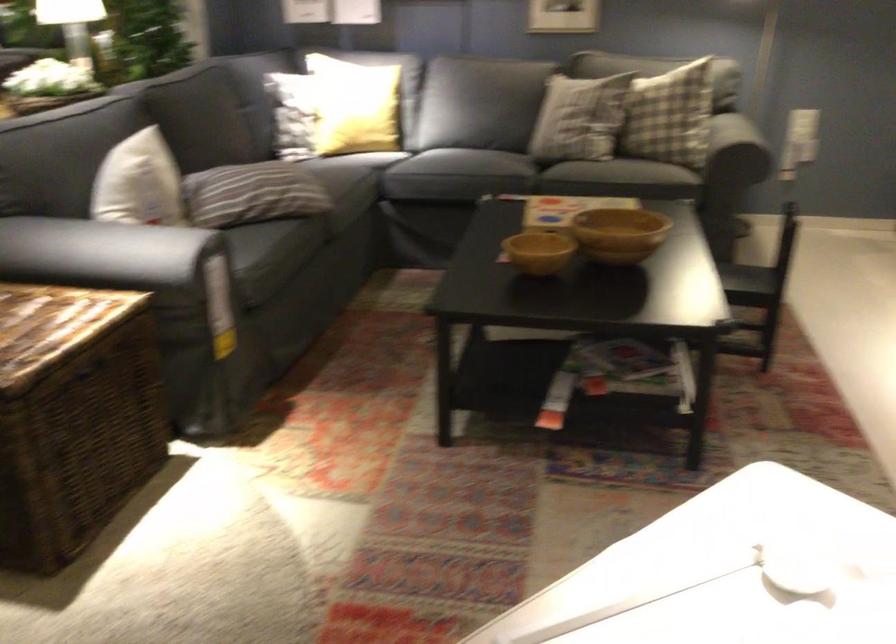
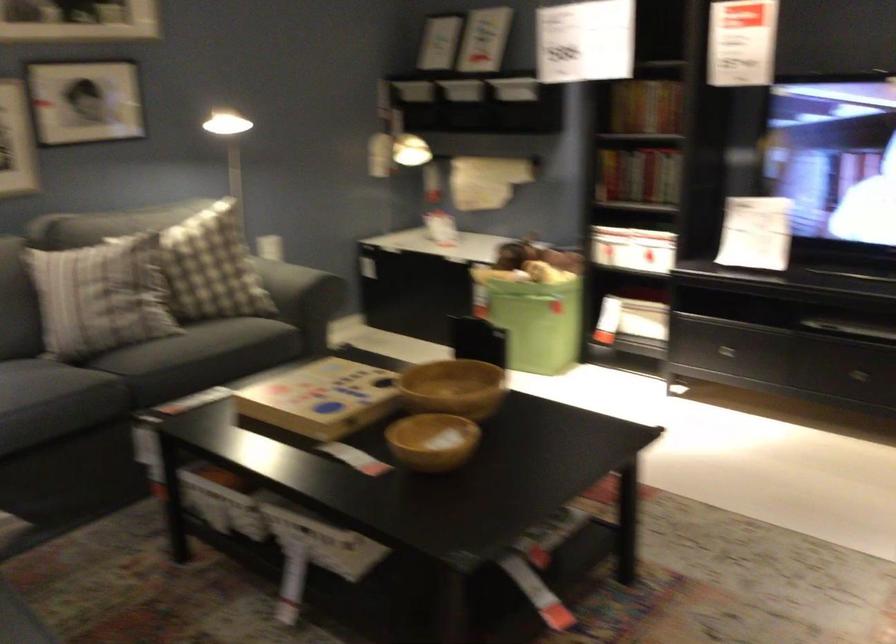
Where in the second image is the point corresponding to point (536, 104) from the first image?

(99, 296)